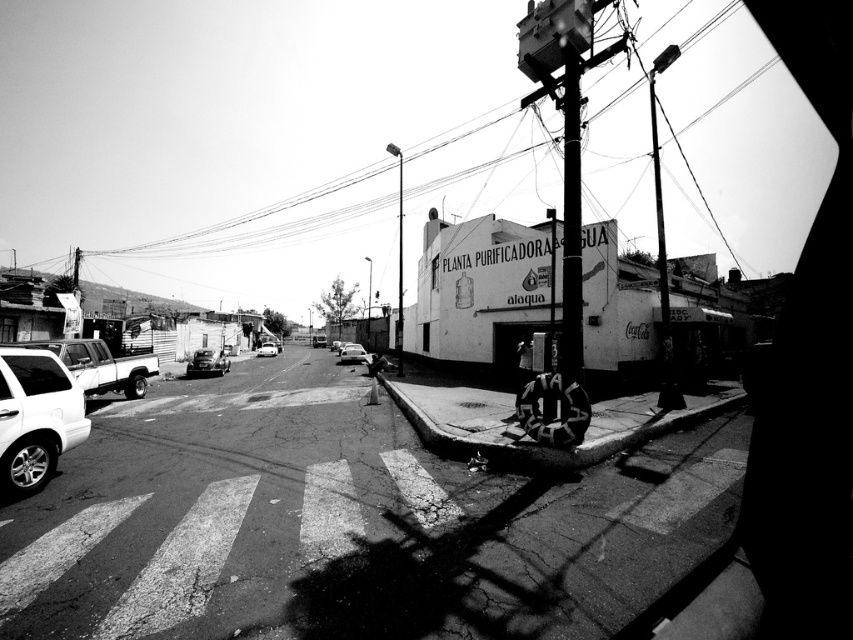
Is point (486, 458) closer to viewer compared to point (83, 346)?

Yes, point (486, 458) is closer to viewer.

Does smooth concrete curb at lower center have a lesser width compared to white matte truck at center-left?

Indeed, smooth concrete curb at lower center has a lesser width compared to white matte truck at center-left.

Is point (421, 419) behind point (67, 364)?

That is False.

Identify the location of smooth concrete curb at lower center. (550, 449).

What are the coordinates of `white matte truck at center-left` in the screenshot? It's located at (100, 365).

Locate an element on the screen. The image size is (853, 640). white matte truck at center-left is located at coordinates (100, 365).

Between white glossy suv at lower left and smooth concrete curb at lower center, which one appears on the right side from the viewer's perspective?

smooth concrete curb at lower center is more to the right.

Between white glossy suv at lower left and smooth concrete curb at lower center, which one has more height?

white glossy suv at lower left is taller.

Where is `white glossy suv at lower left`? Image resolution: width=853 pixels, height=640 pixels. white glossy suv at lower left is located at coordinates (35, 419).